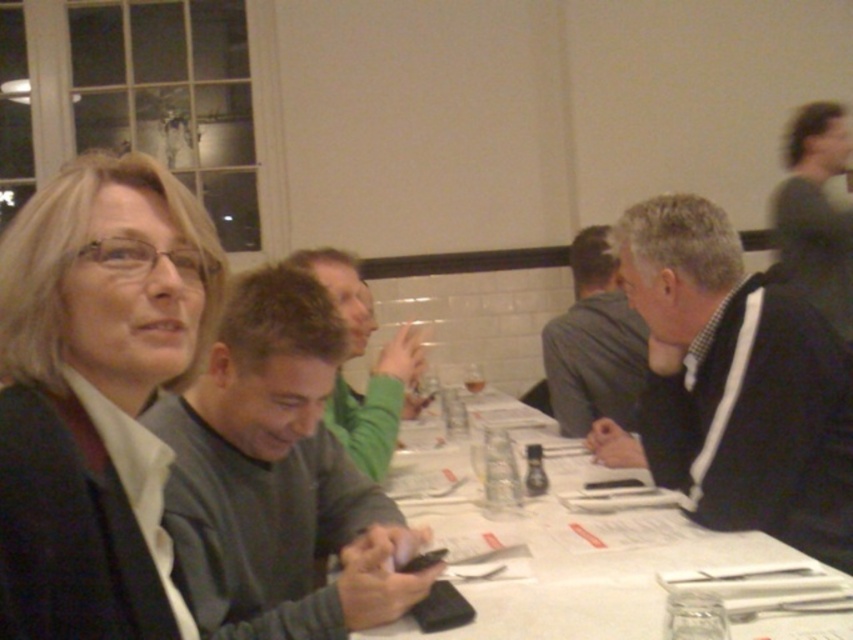
You are looking at the image and see two points marked on the table. The first point is at coordinates point (671, 385) and the second point is at point (463, 371). Which point is closer to you?

Point (671, 385) is closer to the viewer than point (463, 371).